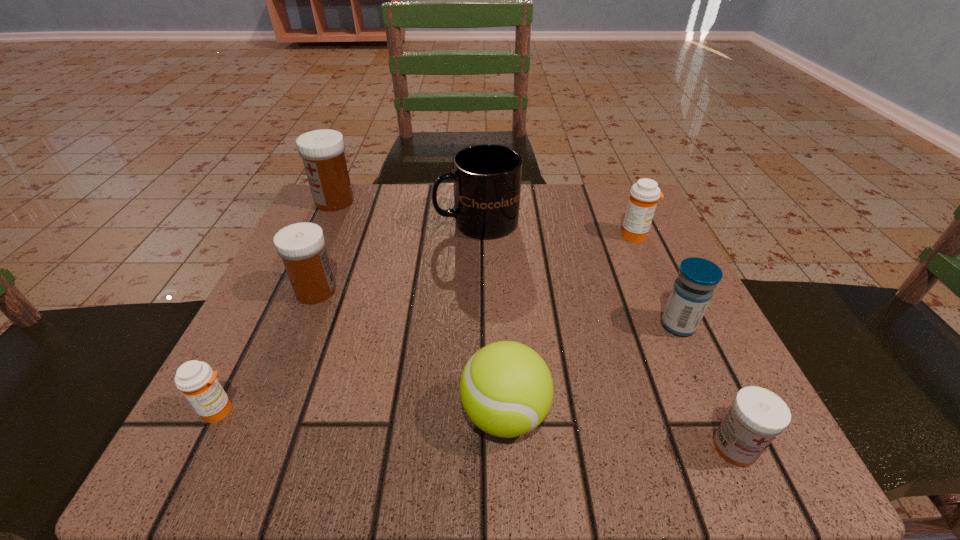
Find the location of `the farthest medicine`. the farthest medicine is located at coordinates (322, 151).

Where is `the tallest medicine`? This screenshot has width=960, height=540. the tallest medicine is located at coordinates (322, 151).

Where is `mug`? The image size is (960, 540). mug is located at coordinates [x=487, y=178].

Locate an element on the screen. Image resolution: width=960 pixels, height=540 pixels. the right orange medicine is located at coordinates (643, 198).

You are a GUI agent. You are given a task and a screenshot of the screen. Output one action in this format:
    pyautogui.click(x=<x>, y=<y>)
    Task: Click on the bigger orange medicine
    
    Given the screenshot: What is the action you would take?
    pyautogui.click(x=643, y=198)

This screenshot has width=960, height=540. Find the location of `the second farthest white medicine`. the second farthest white medicine is located at coordinates (301, 246).

At what (x,y) coordinates should I click in order to perform the action: click on the fourth farthest object. Please return your answer as a coordinate pair (x, y). The image size is (960, 540). Looking at the image, I should click on (301, 246).

Where is `green tennis ball`? The image size is (960, 540). green tennis ball is located at coordinates (506, 389).

Where is `the fourth nearest object`? This screenshot has height=540, width=960. the fourth nearest object is located at coordinates (692, 291).

At what (x,y) coordinates should I click in order to perform the action: click on blue medicine. Please return your answer as a coordinate pair (x, y). This screenshot has width=960, height=540. Looking at the image, I should click on (692, 291).